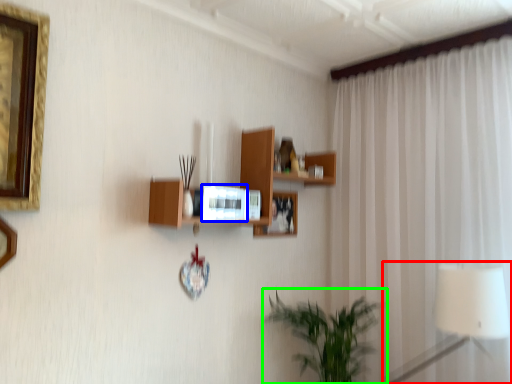
Question: Which is farther away from table lamp (highlighted by a red box)? picture frame (highlighted by a blue box) or houseplant (highlighted by a green box)?

Choices:
 (A) picture frame
 (B) houseplant

Answer: (A)